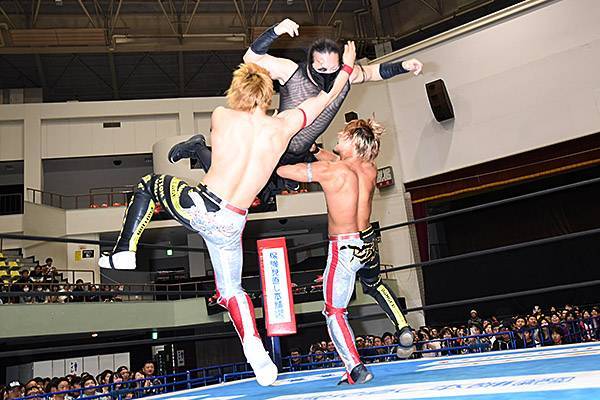
Locate an element on the screen. walls is located at coordinates (500, 119), (375, 100), (65, 134), (12, 113), (195, 120).